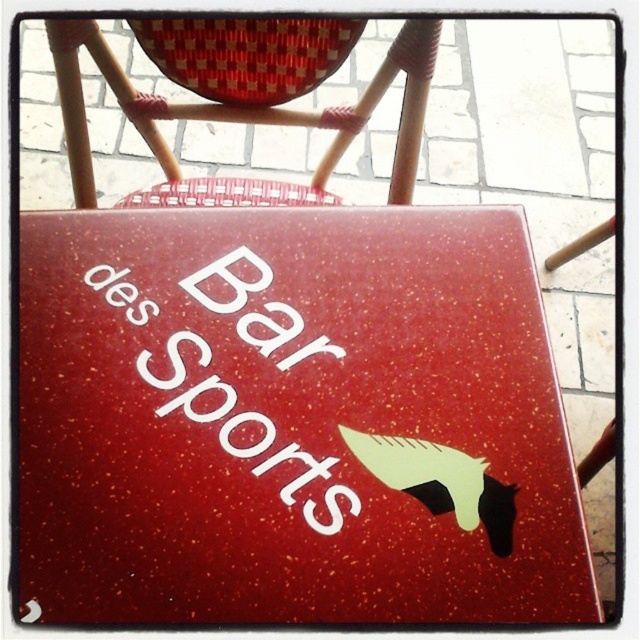
Image resolution: width=640 pixels, height=640 pixels. I want to click on glossy speckled table at center, so click(291, 420).

Can you confirm if glossy speckled table at center is smaller than white speckled paper at center?

No, glossy speckled table at center is not smaller than white speckled paper at center.

Is point (440, 620) behind point (202, 339)?

No.

Image resolution: width=640 pixels, height=640 pixels. In order to click on glossy speckled table at center in this screenshot , I will do `click(291, 420)`.

Is the position of glossy speckled table at center less distant than that of woven rattan chair at upper left?

Yes, glossy speckled table at center is closer to the viewer.

Does glossy speckled table at center have a lesser width compared to woven rattan chair at upper left?

Incorrect, glossy speckled table at center's width is not less than woven rattan chair at upper left's.

Identify the location of glossy speckled table at center. Image resolution: width=640 pixels, height=640 pixels. (291, 420).

Locate an element on the screen. The height and width of the screenshot is (640, 640). glossy speckled table at center is located at coordinates (291, 420).

Can you confirm if woven rattan chair at upper left is positioned below white speckled paper at center?

No.

Between point (61, 70) and point (317, 349), which one is positioned behind?

Positioned behind is point (61, 70).

This screenshot has height=640, width=640. What do you see at coordinates (241, 122) in the screenshot?
I see `woven rattan chair at upper left` at bounding box center [241, 122].

Find the location of `woven rattan chair at upper left`. woven rattan chair at upper left is located at coordinates (241, 122).